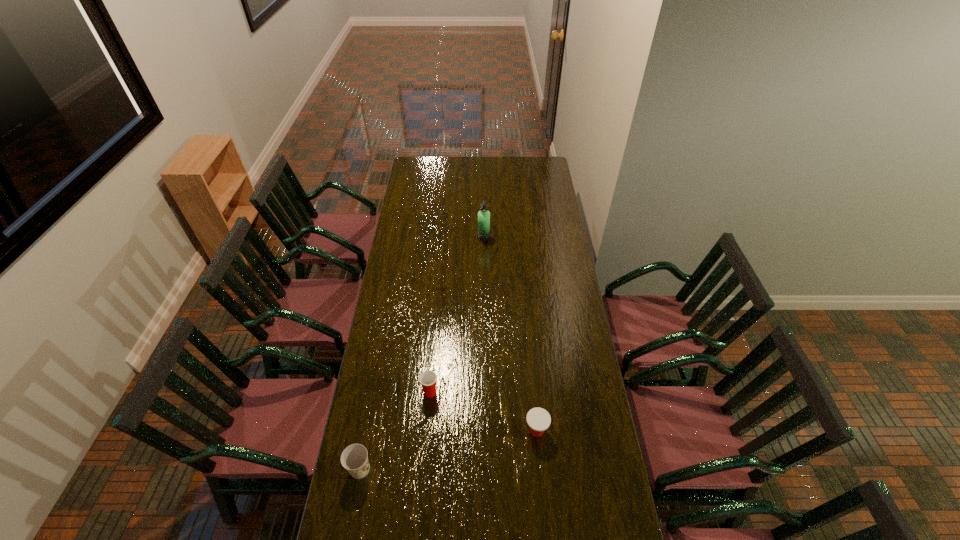
Point out which Dixie cup is positioned as the second nearest to the tallest object. Please provide its 2D coordinates. Your answer should be formatted as a tuple, i.e. [(x, y)], where the tuple contains the x and y coordinates of a point satisfying the conditions above.

[(538, 419)]